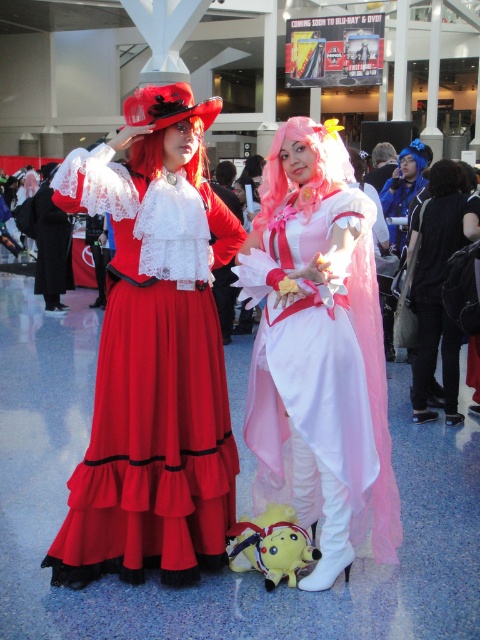
You are a photographer at the event and want to capture a photo where both the pink silky wig at center and the yellow plush at lower center are clearly visible. Which object should you adjust to ensure both are in the frame?

You should move the yellow plush at lower center forward so it is not behind the pink silky wig at center, ensuring both are visible in the photo.

You are a photographer at a convention and need to capture a clear photo of both the pink silky wig at center and the red velvet wig at center. Based on their positions, which wig should you focus on first to ensure it appears sharp in the photo?

You should focus on the pink silky wig at center first because the red velvet wig at center is behind it, so adjusting focus to the front wig ensures both are in focus if they are close in distance.

You are a photographer at a costume event. You need to position the pink silky wig at center and the red velvet wig at center so that both are visible in the frame. Which wig should you place closer to the camera to ensure both are fully visible?

The pink silky wig at center is taller than the red velvet wig at center, so to ensure both are fully visible in the frame, you should place the shorter red velvet wig at center closer to the camera.